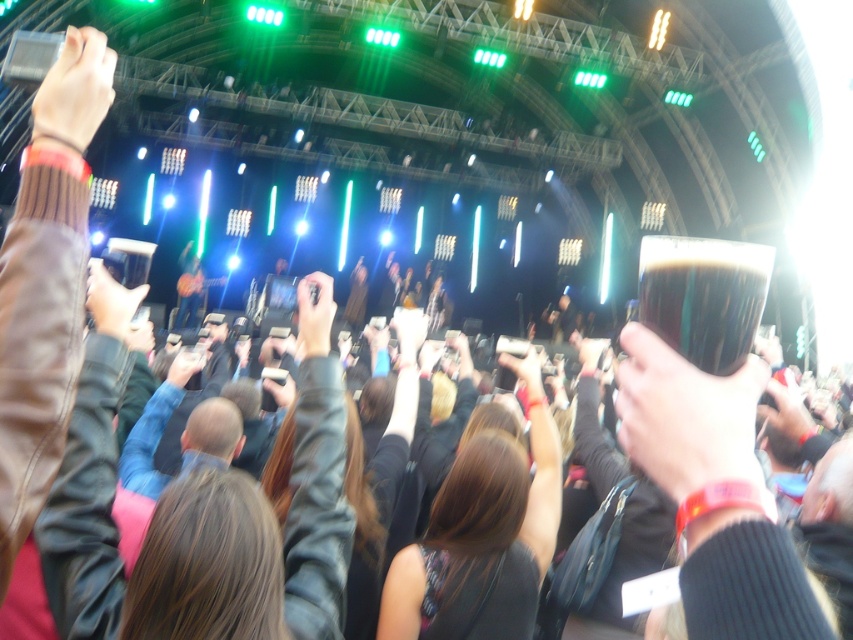
You are a photographer at the concert. You have a camera and want to take a photo of the brown leather jacket at center from your current position. The camera requires a minimum distance of 5 meters to focus properly. Can you take a clear photo?

The camera and brown leather jacket at center are 5.51 meters apart from each other, so yes, the photographer can take a clear photo since the distance is greater than the required 5 meters.

You are at a concert and want to take a photo of the stage. You notice a brown leather jacket at center and a dark glass beer at upper center in your viewfinder. Which object should you move your camera to the right to include in the frame?

The brown leather jacket at center is positioned on the left side of dark glass beer at upper center. To include the dark glass beer at upper center in the frame, you should move your camera to the right.